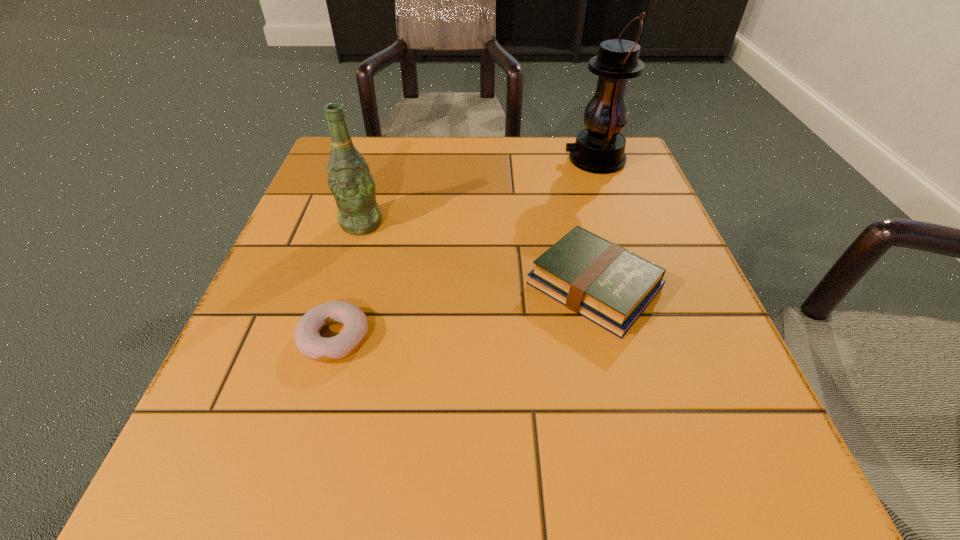
Where is `the farthest object`? This screenshot has height=540, width=960. the farthest object is located at coordinates (600, 148).

You are a GUI agent. You are given a task and a screenshot of the screen. Output one action in this format:
    pyautogui.click(x=<x>, y=<y>)
    Task: Click on the lantern
    
    Given the screenshot: What is the action you would take?
    pyautogui.click(x=600, y=148)

You are a GUI agent. You are given a task and a screenshot of the screen. Output one action in this format:
    pyautogui.click(x=<x>, y=<y>)
    Task: Click on the third shortest object
    
    Given the screenshot: What is the action you would take?
    pyautogui.click(x=349, y=179)

The image size is (960, 540). In order to click on the second farthest object in this screenshot , I will do `click(349, 179)`.

The height and width of the screenshot is (540, 960). I want to click on the third tallest object, so click(605, 283).

This screenshot has height=540, width=960. What are the coordinates of `doughnut` in the screenshot? It's located at (308, 341).

Identify a few places in the vacant region located 0.300m above the farthest object, indicating its light source. Please provide its 2D coordinates. Your answer should be formatted as a tuple, i.e. [(x, y)], where the tuple contains the x and y coordinates of a point satisfying the conditions above.

[(432, 160)]

Find several locations within the vacant space located above the farthest object, indicating its light source. Please provide its 2D coordinates. Your answer should be formatted as a tuple, i.e. [(x, y)], where the tuple contains the x and y coordinates of a point satisfying the conditions above.

[(450, 160)]

Find several locations within the vacant space located above the farthest object, indicating its light source. Please provide its 2D coordinates. Your answer should be formatted as a tuple, i.e. [(x, y)], where the tuple contains the x and y coordinates of a point satisfying the conditions above.

[(454, 160)]

This screenshot has width=960, height=540. I want to click on vacant space located 0.080m on the surface of the third shortest object, so click(x=348, y=267).